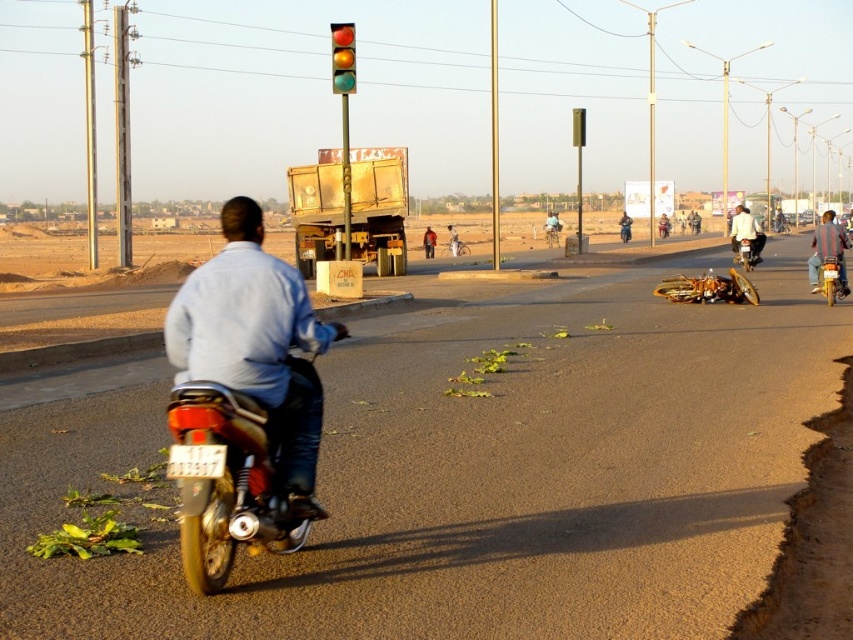
Is point (219, 556) less distant than point (456, 246)?

Yes, it is in front of point (456, 246).

Who is more distant from viewer, (288, 355) or (457, 244)?

The point (457, 244) is more distant.

This screenshot has height=640, width=853. What do you see at coordinates (230, 480) in the screenshot? I see `metallic gold motorcycle at center-left` at bounding box center [230, 480].

The image size is (853, 640). Identify the location of metallic gold motorcycle at center-left. coord(230,480).

Can you confirm if metallic silver motorcycle at right is shorter than metallic silver bicycle at center?

Correct, metallic silver motorcycle at right is not as tall as metallic silver bicycle at center.

Does point (740, 244) come in front of point (544, 234)?

Yes, point (740, 244) is in front of point (544, 234).

Image resolution: width=853 pixels, height=640 pixels. In order to click on metallic silver motorcycle at right in this screenshot , I will do `click(747, 250)`.

Can you confirm if silver metallic bicycle at center is smaller than metallic silver bicycle at center?

Indeed, silver metallic bicycle at center has a smaller size compared to metallic silver bicycle at center.

The height and width of the screenshot is (640, 853). Find the location of `silver metallic bicycle at center`. silver metallic bicycle at center is located at coordinates (454, 248).

Between point (448, 244) and point (558, 236), which one is positioned behind?

Positioned behind is point (558, 236).

At what (x,y) coordinates should I click in order to perform the action: click on silver metallic bicycle at center. Please return your answer as a coordinate pair (x, y). This screenshot has width=853, height=640. Looking at the image, I should click on (454, 248).